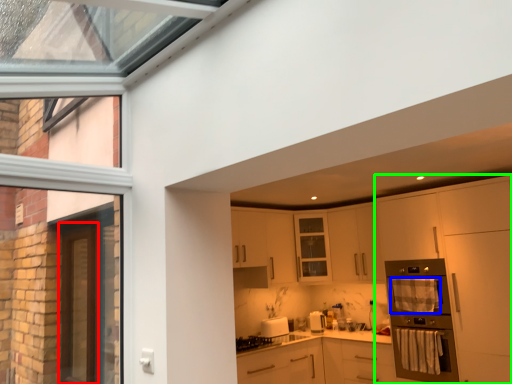
Question: Considering the real-world distances, which object is farthest from screen door (highlighted by a red box)? material (highlighted by a blue box) or cabinetry (highlighted by a green box)?

Choices:
 (A) material
 (B) cabinetry

Answer: (B)